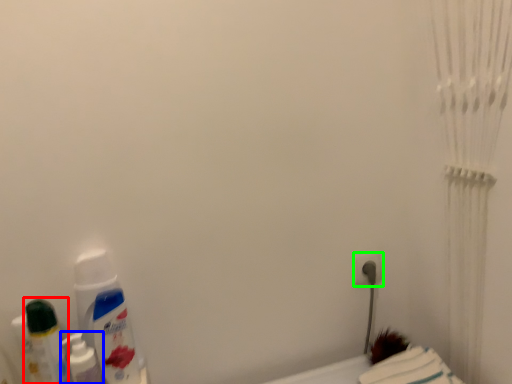
Question: Estimate the real-world distances between objects in this image. Which object is farther from mouthwash (highlighted by a red box), mouthwash (highlighted by a blue box) or power plugs and sockets (highlighted by a green box)?

Choices:
 (A) mouthwash
 (B) power plugs and sockets

Answer: (B)